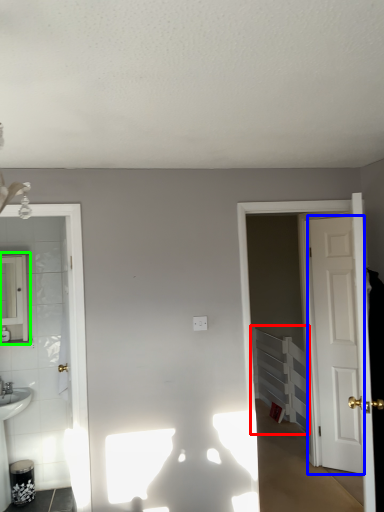
Question: Estimate the real-world distances between objects in this image. Which object is farther from radiator (highlighted by a red box), door (highlighted by a blue box) or mirror (highlighted by a green box)?

Choices:
 (A) door
 (B) mirror

Answer: (B)